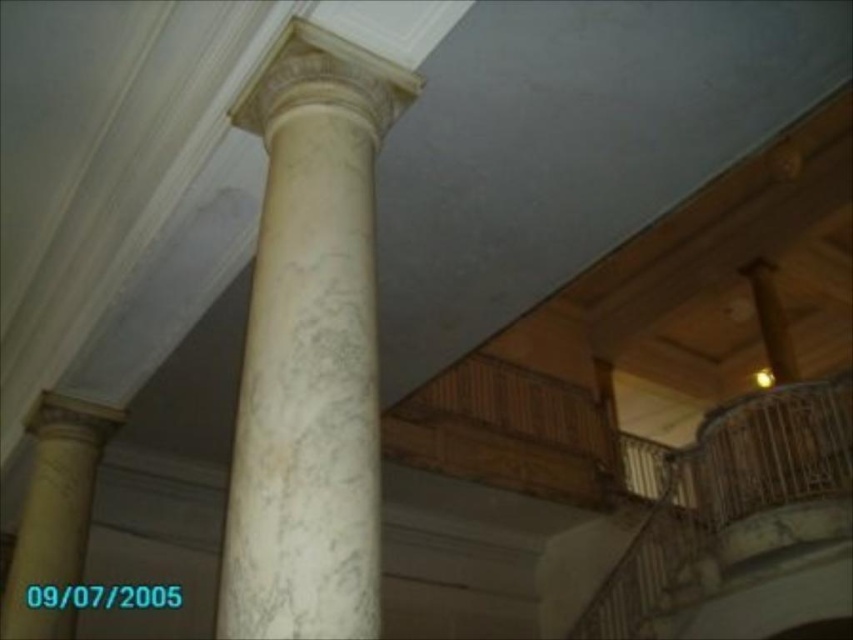
Question: Is white marble column at center positioned behind white marble column at left?

Choices:
 (A) no
 (B) yes

Answer: (A)

Question: Among these objects, which one is nearest to the camera?

Choices:
 (A) white marble column at center
 (B) white marble column at left

Answer: (A)

Question: Among these objects, which one is farthest from the camera?

Choices:
 (A) white marble column at center
 (B) white marble column at left

Answer: (B)

Question: Which of the following is the closest to the observer?

Choices:
 (A) white marble column at left
 (B) white marble column at center

Answer: (B)

Question: Does white marble column at center have a lesser width compared to white marble column at left?

Choices:
 (A) yes
 (B) no

Answer: (B)

Question: Is the position of white marble column at center less distant than that of white marble column at left?

Choices:
 (A) no
 (B) yes

Answer: (B)